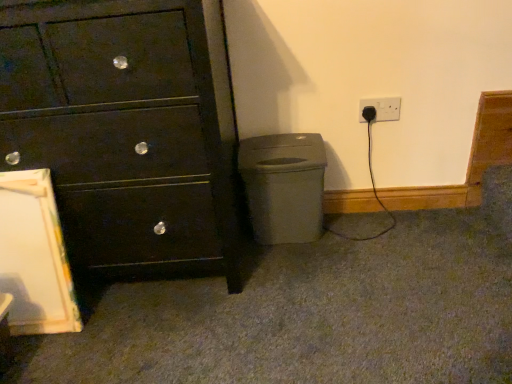
Identify the location of empty space that is in between matte gray plastic at lower right and matte black chest of drawers at left. (283, 259).